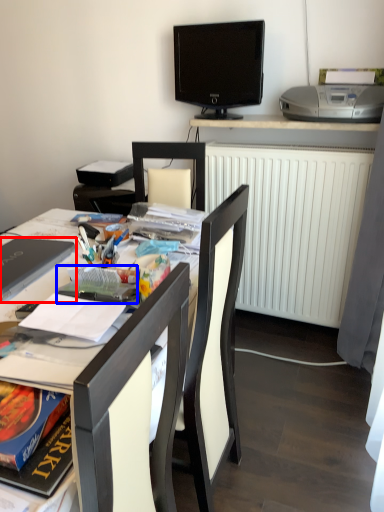
Question: Among these objects, which one is nearest to the camera, laptop (highlighted by a red box) or paperback book (highlighted by a blue box)?

Choices:
 (A) laptop
 (B) paperback book

Answer: (B)